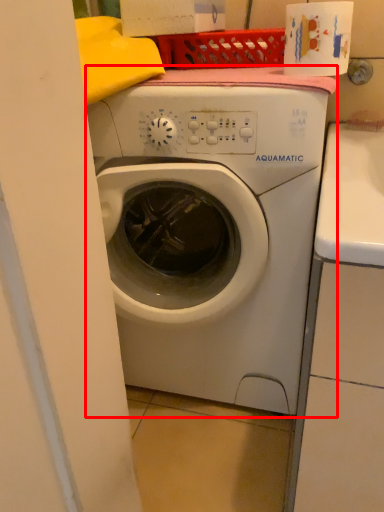
Question: From the image's perspective, where is washing machine (annotated by the red box) located relative to toilet paper?

Choices:
 (A) below
 (B) above

Answer: (A)